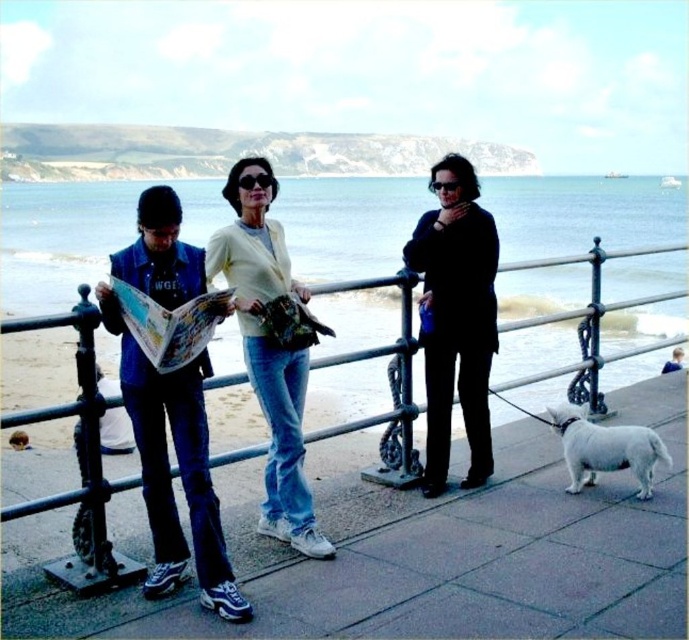
Is point (147, 461) closer to viewer compared to point (619, 465)?

Yes, it is.

Can you confirm if denim jacket at left is positioned above white fur dog at lower right?

Yes, denim jacket at left is above white fur dog at lower right.

This screenshot has width=689, height=640. Identify the location of denim jacket at left. (178, 468).

Between black metal fence at center and black matte jacket at center, which one is positioned lower?

black metal fence at center is lower down.

Based on the photo, which of these two, black metal fence at center or black matte jacket at center, stands taller?

black matte jacket at center is taller.

Is point (92, 316) closer to viewer compared to point (424, 380)?

That is True.

Locate an element on the screen. black metal fence at center is located at coordinates (378, 356).

Does denim jacket at left have a smaller size compared to black matte jacket at center?

Incorrect, denim jacket at left is not smaller in size than black matte jacket at center.

Can you confirm if denim jacket at left is wider than black matte jacket at center?

Yes.

Measure the distance between point (158,212) and camera.

Point (158,212) is 12.66 meters away from camera.

Image resolution: width=689 pixels, height=640 pixels. I want to click on denim jacket at left, so click(178, 468).